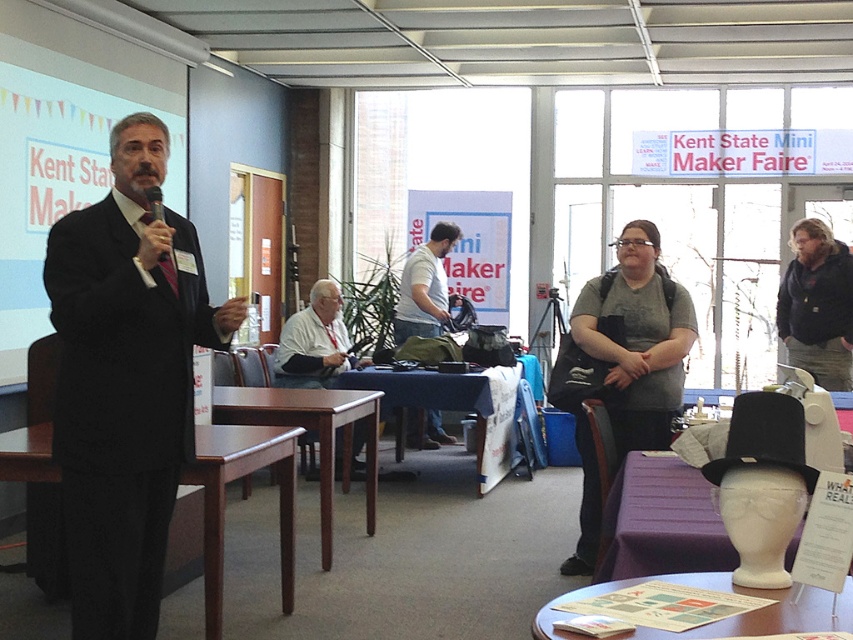
You are attending the Kent State Mini Maker Faire and want to take a photo of the white fabric shirt at center without including the purple fabric table at lower right in the frame. Is this possible based on their positions?

A: The purple fabric table at lower right is in front of the white fabric shirt at center, so it would block the view. Therefore, you cannot take a photo of the white fabric shirt at center without including the purple fabric table at lower right in the frame.

You are a photographer at the Kent State Mini Maker Faire. You need to set up your camera to capture a photo of the blue fabric table at center. Given that the camera and the table are 6.02 meters apart, will you need a telephoto lens to focus on the table from where you are standing?

The blue fabric table at center and the camera are 6.02 meters apart. A telephoto lens is typically used for distant subjects, so at 6.02 meters, a standard lens should suffice unless the table is very small. However, since the question doesn not specify the table size, the distance alone suggests a telephoto isn necessary. Use a standard lens.

You are an attendee at the Kent State Mini Maker Faire and need to place a 1.2 meter wide poster on either the purple fabric table at lower right or the white fabric shirt at center. Which surface can accommodate the poster without overhanging?

The white fabric shirt at center has a greater width than the purple fabric table at lower right, so the poster can be placed on the white fabric shirt at center without overhanging.